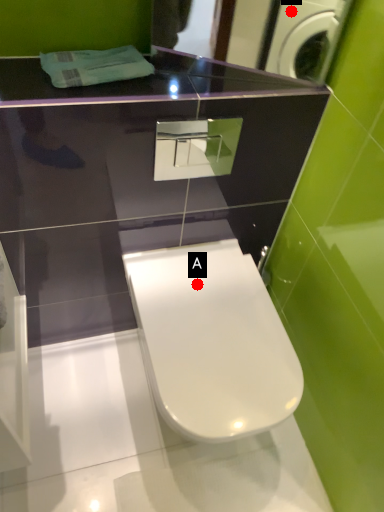
Question: Two points are circled on the image, labeled by A and B beside each circle. Which of the following is the closest to the observer?

Choices:
 (A) A is closer
 (B) B is closer

Answer: (A)